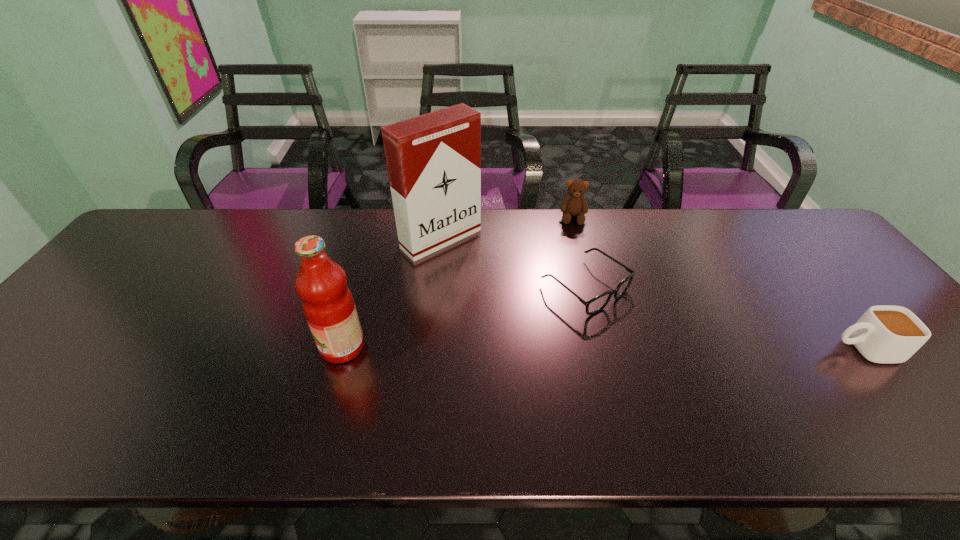
This screenshot has width=960, height=540. In order to click on object that stands as the fourth closest to the fruit juice in this screenshot , I will do `click(884, 334)`.

Identify which object is the closest to the rightmost object. Please provide its 2D coordinates. Your answer should be formatted as a tuple, i.e. [(x, y)], where the tuple contains the x and y coordinates of a point satisfying the conditions above.

[(593, 306)]

Identify the location of vacant space that satisfies the following two spatial constraints: 1. on the front side of the rightmost object; 2. on the side with the handle of the teddy bear. (608, 349).

Where is `vacant region that satisfies the following two spatial constraints: 1. on the front side of the cup; 2. on the side with the handle of the teddy bear`? vacant region that satisfies the following two spatial constraints: 1. on the front side of the cup; 2. on the side with the handle of the teddy bear is located at coordinates (608, 349).

Where is `free space that satisfies the following two spatial constraints: 1. on the back side of the second object from left to right; 2. on the left side of the teddy bear`? The height and width of the screenshot is (540, 960). free space that satisfies the following two spatial constraints: 1. on the back side of the second object from left to right; 2. on the left side of the teddy bear is located at coordinates (444, 217).